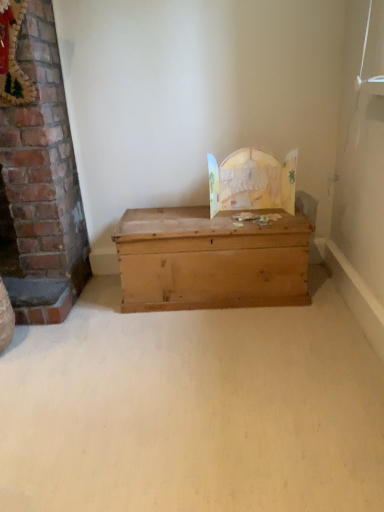
The width and height of the screenshot is (384, 512). Describe the element at coordinates (41, 185) in the screenshot. I see `brick fireplace at left` at that location.

Locate an element on the screen. brick fireplace at left is located at coordinates (41, 185).

What do you see at coordinates (210, 260) in the screenshot?
I see `natural wood trunk at center` at bounding box center [210, 260].

Identify the location of natural wood trunk at center. (210, 260).

Identify the location of brick fireplace at left. The height and width of the screenshot is (512, 384). (41, 185).

Between natural wood trunk at center and brick fireplace at left, which one appears on the left side from the viewer's perspective?

brick fireplace at left is more to the left.

Does natural wood trunk at center come in front of brick fireplace at left?

No, it is not.

Which point is more distant from viewer, (289, 290) or (29, 22)?

The point (289, 290) is farther.

From the image's perspective, is natural wood trunk at center located above brick fireplace at left?

No.

From a real-world perspective, is natural wood trunk at center located beneath brick fireplace at left?

Correct, in the physical world, natural wood trunk at center is lower than brick fireplace at left.

Considering the relative sizes of natural wood trunk at center and brick fireplace at left in the image provided, is natural wood trunk at center wider than brick fireplace at left?

Indeed, natural wood trunk at center has a greater width compared to brick fireplace at left.

Does natural wood trunk at center have a lesser height compared to brick fireplace at left?

Yes.

Is natural wood trunk at center bigger than brick fireplace at left?

Indeed, natural wood trunk at center has a larger size compared to brick fireplace at left.

Is natural wood trunk at center not inside brick fireplace at left?

natural wood trunk at center lies outside brick fireplace at left's area.

Is natural wood trunk at center touching brick fireplace at left?

No, natural wood trunk at center is not with brick fireplace at left.

Is natural wood trunk at center oriented away from brick fireplace at left?

No.

In the scene shown: What's the angular difference between natural wood trunk at center and brick fireplace at left's facing directions?

The angular difference between natural wood trunk at center and brick fireplace at left is 88.1 degrees.

The image size is (384, 512). I want to click on fireplace that is above the natural wood trunk at center (from a real-world perspective), so click(41, 185).

In the image, is brick fireplace at left on the left side or the right side of natural wood trunk at center?

brick fireplace at left is to the left of natural wood trunk at center.

Which object is closer to the camera taking this photo, brick fireplace at left or natural wood trunk at center?

brick fireplace at left is in front.

Which point is more forward, (58, 302) or (273, 252)?

The point (273, 252) is more forward.

From the image's perspective, does brick fireplace at left appear higher than natural wood trunk at center?

Yes, from the image's perspective, brick fireplace at left is above natural wood trunk at center.

From a real-world perspective, is brick fireplace at left positioned under natural wood trunk at center based on gravity?

No, from a real-world perspective, brick fireplace at left is not under natural wood trunk at center.

Looking at this image, which of these two, brick fireplace at left or natural wood trunk at center, is thinner?

brick fireplace at left is thinner.

From their relative heights in the image, would you say brick fireplace at left is taller or shorter than natural wood trunk at center?

Clearly, brick fireplace at left is taller compared to natural wood trunk at center.

Can you confirm if brick fireplace at left is bigger than natural wood trunk at center?

Actually, brick fireplace at left might be smaller than natural wood trunk at center.

Looking at this image, is natural wood trunk at center located within brick fireplace at left?

No, natural wood trunk at center is not inside brick fireplace at left.

Is brick fireplace at left not close to natural wood trunk at center?

No, brick fireplace at left is not far away from natural wood trunk at center.

Does brick fireplace at left turn towards natural wood trunk at center?

Yes, brick fireplace at left is facing natural wood trunk at center.

How many degrees apart are the facing directions of brick fireplace at left and natural wood trunk at center?

brick fireplace at left and natural wood trunk at center are facing 88.1 degrees away from each other.

This screenshot has height=512, width=384. What are the coordinates of `table that is below the brick fireplace at left (from the image's perspective)` in the screenshot? It's located at (210, 260).

What are the coordinates of `fireplace that is above the natural wood trunk at center (from a real-world perspective)` in the screenshot? It's located at (41, 185).

I want to click on table behind the brick fireplace at left, so click(x=210, y=260).